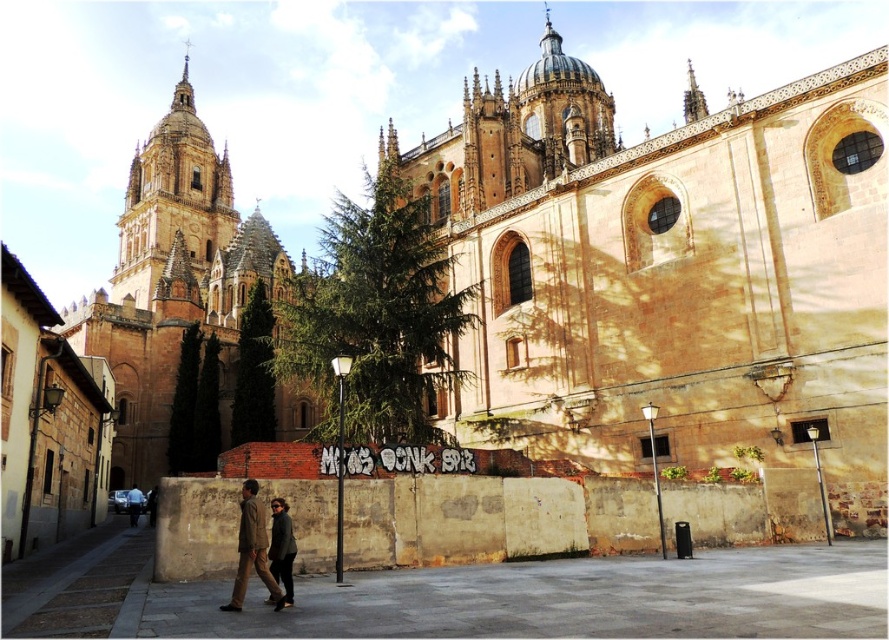
You are a visitor at the cathedral and want to place a small potted plant between the dark brown leather jacket at lower center and the dark brown leather jacket at lower left. Based on their sizes, will there be enough space for the plant?

The dark brown leather jacket at lower center occupies less space than the dark brown leather jacket at lower left, so there should be enough space between them to place a small potted plant.

You are standing at point A, which is at coordinates (174, 284). Looking around, you see a brown stone church at upper left. What is located at your current position?

At point A, which is at coordinates (174, 284), the brown stone church at upper left is located there.